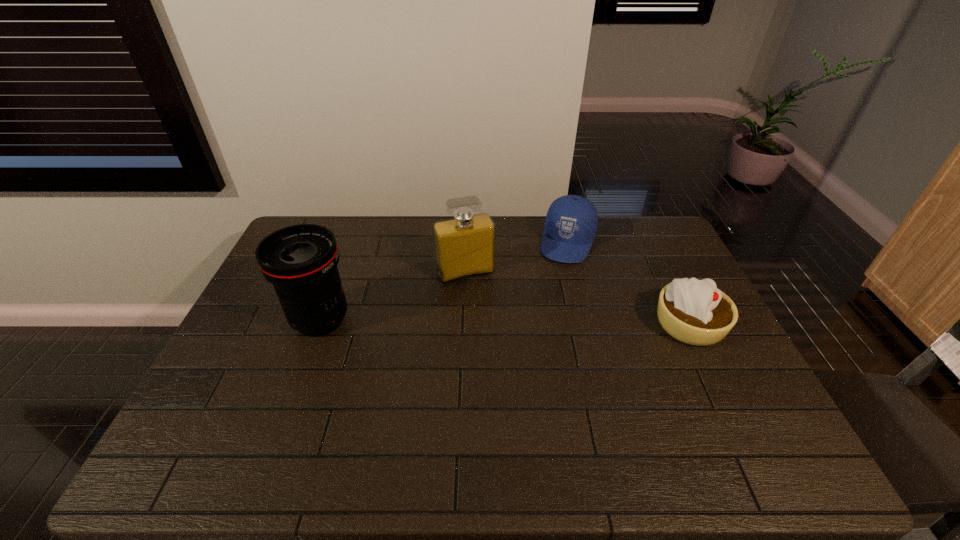
Image resolution: width=960 pixels, height=540 pixels. I want to click on the leftmost object, so click(x=300, y=261).

Where is `the rightmost object`? The image size is (960, 540). the rightmost object is located at coordinates (695, 312).

This screenshot has height=540, width=960. I want to click on perfume, so click(x=465, y=245).

Find the location of `the second object from right to left`. the second object from right to left is located at coordinates (571, 222).

Locate an element on the screen. The width and height of the screenshot is (960, 540). vacant space located 0.210m on the front of the telephoto lens is located at coordinates (286, 413).

This screenshot has width=960, height=540. Find the location of `free space located on the left of the whipped cream`. free space located on the left of the whipped cream is located at coordinates (527, 325).

What are the coordinates of `vacant area located on the front-facing side of the second object from left to right` in the screenshot? It's located at (513, 369).

Image resolution: width=960 pixels, height=540 pixels. What are the coordinates of `blank space located on the front-facing side of the second object from left to right` in the screenshot? It's located at (479, 295).

The height and width of the screenshot is (540, 960). Find the location of `vacant space located 0.210m on the front-facing side of the second object from left to right`. vacant space located 0.210m on the front-facing side of the second object from left to right is located at coordinates (495, 331).

Find the location of `vacant space situated 0.260m on the front-facing side of the third object from left to right`. vacant space situated 0.260m on the front-facing side of the third object from left to right is located at coordinates (544, 316).